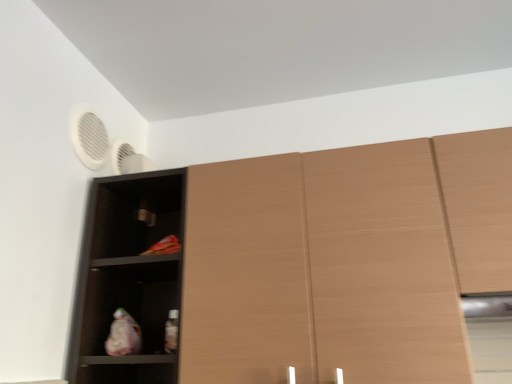
Question: Visually, is matte black shelf at left positioned to the left or to the right of light brown wood cabinet at right?

Choices:
 (A) right
 (B) left

Answer: (B)

Question: Considering the positions of matte black shelf at left and light brown wood cabinet at right in the image, is matte black shelf at left bigger or smaller than light brown wood cabinet at right?

Choices:
 (A) big
 (B) small

Answer: (A)

Question: Based on their relative distances, which object is nearer to the wooden cupboard at center?

Choices:
 (A) white matte fan at upper left
 (B) matte black shelf at left
 (C) light brown wood cabinet at right

Answer: (B)

Question: Which is nearer to the white matte fan at upper left?

Choices:
 (A) light brown wood cabinet at right
 (B) matte black shelf at left
 (C) wooden cupboard at center

Answer: (B)